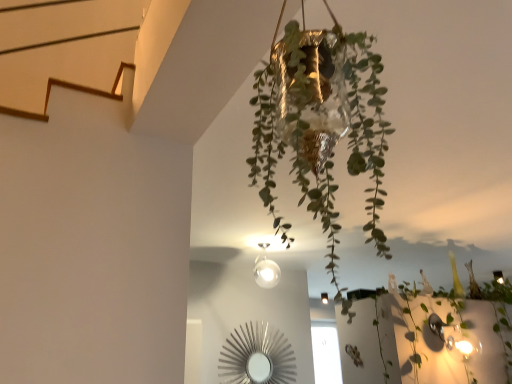
Question: Is matte white glass light fixture at center bigger than gold foil pot at center?

Choices:
 (A) no
 (B) yes

Answer: (A)

Question: From a real-world perspective, is matte white glass light fixture at center positioned under gold foil pot at center based on gravity?

Choices:
 (A) yes
 (B) no

Answer: (B)

Question: Is matte white glass light fixture at center at the left side of gold foil pot at center?

Choices:
 (A) yes
 (B) no

Answer: (B)

Question: Is the surface of matte white glass light fixture at center in direct contact with gold foil pot at center?

Choices:
 (A) yes
 (B) no

Answer: (B)

Question: Can you confirm if matte white glass light fixture at center is shorter than gold foil pot at center?

Choices:
 (A) no
 (B) yes

Answer: (B)

Question: Is matte white glass light fixture at center outside gold foil pot at center?

Choices:
 (A) no
 (B) yes

Answer: (B)

Question: Does gold foil pot at center have a greater width compared to green leafy plant at center?

Choices:
 (A) no
 (B) yes

Answer: (A)

Question: From the image's perspective, is gold foil pot at center located above green leafy plant at center?

Choices:
 (A) yes
 (B) no

Answer: (A)

Question: From a real-world perspective, is gold foil pot at center physically below green leafy plant at center?

Choices:
 (A) no
 (B) yes

Answer: (A)

Question: Could you tell me if gold foil pot at center is turned towards green leafy plant at center?

Choices:
 (A) yes
 (B) no

Answer: (B)

Question: Is gold foil pot at center not inside green leafy plant at center?

Choices:
 (A) yes
 (B) no

Answer: (A)

Question: From the image's perspective, is gold foil pot at center under green leafy plant at center?

Choices:
 (A) yes
 (B) no

Answer: (B)

Question: From the image's perspective, is green leafy plant at center on matte white glass light fixture at center?

Choices:
 (A) yes
 (B) no

Answer: (A)